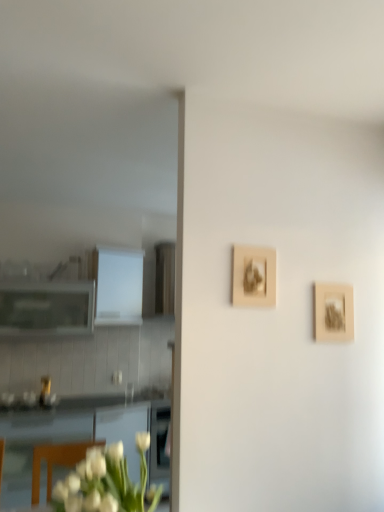
Question: Is wooden frame at right, the first picture frame from the back, bigger than white matte flower at lower left?

Choices:
 (A) yes
 (B) no

Answer: (B)

Question: From the image's perspective, would you say wooden frame at right, positioned as the 1th picture frame in right-to-left order, is positioned over white matte flower at lower left?

Choices:
 (A) yes
 (B) no

Answer: (A)

Question: Would you say wooden frame at right, positioned as the 1th picture frame in right-to-left order, is outside white matte flower at lower left?

Choices:
 (A) yes
 (B) no

Answer: (A)

Question: Can you confirm if wooden frame at right, the 2th picture frame in the front-to-back sequence, is positioned to the left of white matte flower at lower left?

Choices:
 (A) no
 (B) yes

Answer: (A)

Question: Is wooden frame at right, which is counted as the second picture frame, starting from the left, facing away from white matte flower at lower left?

Choices:
 (A) no
 (B) yes

Answer: (A)

Question: Based on their sizes in the image, would you say white glossy cabinet at left, which appears as the 2th cabinetry when viewed from the left, is bigger or smaller than beige textured frame at upper center, the first picture frame positioned from the front?

Choices:
 (A) small
 (B) big

Answer: (B)

Question: Would you say white glossy cabinet at left, which appears as the 2th cabinetry when viewed from the left, is to the left or to the right of beige textured frame at upper center, placed as the second picture frame when sorted from right to left, in the picture?

Choices:
 (A) right
 (B) left

Answer: (B)

Question: Considering their positions, is white glossy cabinet at left, which appears as the 2th cabinetry when viewed from the left, located in front of or behind beige textured frame at upper center, marked as the first picture frame in a left-to-right arrangement?

Choices:
 (A) behind
 (B) front

Answer: (A)

Question: In terms of height, does white glossy cabinet at left, which appears as the 2th cabinetry when viewed from the left, look taller or shorter compared to beige textured frame at upper center, marked as the first picture frame in a left-to-right arrangement?

Choices:
 (A) short
 (B) tall

Answer: (B)

Question: Is point (345, 326) positioned closer to the camera than point (243, 252)?

Choices:
 (A) farther
 (B) closer

Answer: (A)

Question: Considering the positions of wooden frame at right, positioned as the 1th picture frame in right-to-left order, and beige textured frame at upper center, placed as the second picture frame when sorted from right to left, in the image, is wooden frame at right, positioned as the 1th picture frame in right-to-left order, wider or thinner than beige textured frame at upper center, placed as the second picture frame when sorted from right to left,?

Choices:
 (A) wide
 (B) thin

Answer: (B)

Question: Would you say wooden frame at right, which is counted as the second picture frame, starting from the left, is inside or outside beige textured frame at upper center, placed as the second picture frame when sorted from right to left?

Choices:
 (A) outside
 (B) inside

Answer: (A)

Question: In the image, is wooden frame at right, the first picture frame from the back, positioned in front of or behind beige textured frame at upper center, the first picture frame positioned from the front?

Choices:
 (A) behind
 (B) front

Answer: (A)

Question: In terms of width, does white glossy cabinet at left, acting as the first cabinetry starting from the right, look wider or thinner when compared to white matte flower at lower left?

Choices:
 (A) thin
 (B) wide

Answer: (A)

Question: From their relative heights in the image, would you say white glossy cabinet at left, which appears as the 2th cabinetry when viewed from the left, is taller or shorter than white matte flower at lower left?

Choices:
 (A) tall
 (B) short

Answer: (A)